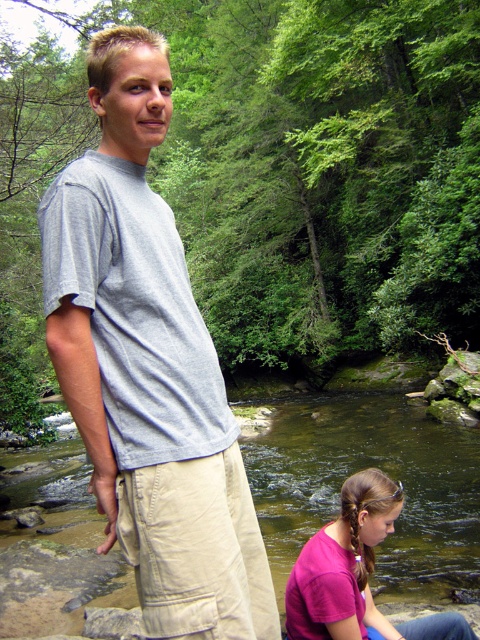
Question: Which object is positioned closest to the green smooth water at lower center?

Choices:
 (A) khaki cotton shorts at lower center
 (B) gray cotton t-shirt at center

Answer: (A)

Question: Is gray cotton t-shirt at center below green smooth water at lower center?

Choices:
 (A) no
 (B) yes

Answer: (A)

Question: Can you confirm if gray cotton t-shirt at center is bigger than pink matte shirt at lower center?

Choices:
 (A) no
 (B) yes

Answer: (B)

Question: Estimate the real-world distances between objects in this image. Which object is farther from the gray cotton t-shirt at center?

Choices:
 (A) green smooth water at lower center
 (B) pink matte shirt at lower center
 (C) khaki cotton shorts at lower center

Answer: (A)

Question: Is gray cotton t-shirt at center bigger than green smooth water at lower center?

Choices:
 (A) no
 (B) yes

Answer: (A)

Question: Among these objects, which one is nearest to the camera?

Choices:
 (A) pink matte shirt at lower center
 (B) green smooth water at lower center

Answer: (A)